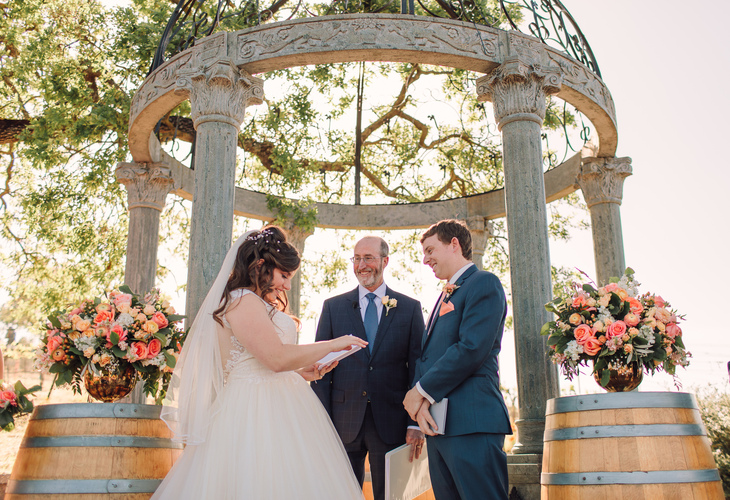
Find the location of `vases`. vases is located at coordinates (120, 392), (636, 379).